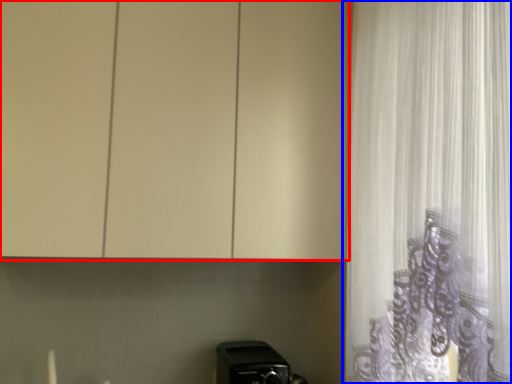
Question: Among these objects, which one is farthest to the camera, cabinetry (highlighted by a red box) or curtain (highlighted by a blue box)?

Choices:
 (A) cabinetry
 (B) curtain

Answer: (A)